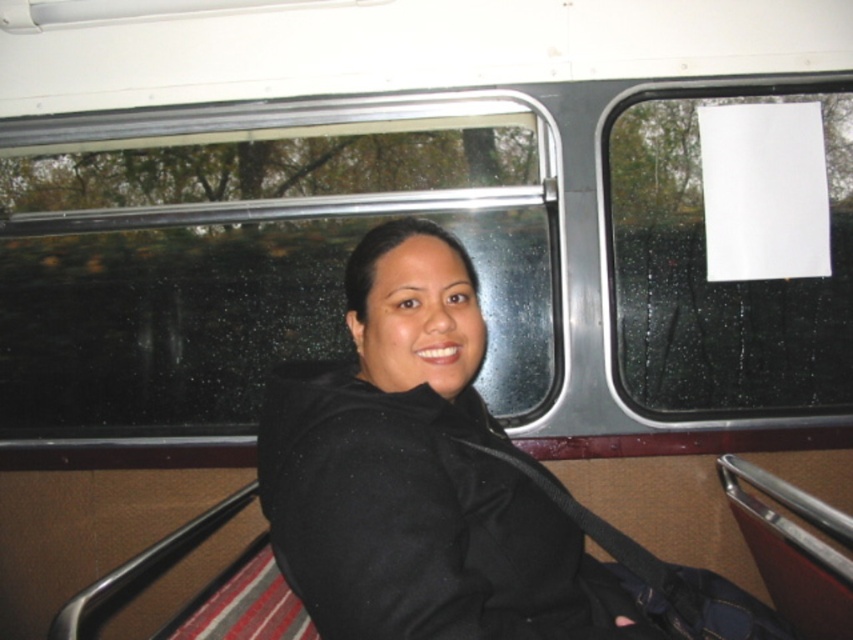
Question: In this image, where is black matte jacket at center located relative to white paper at upper right?

Choices:
 (A) right
 (B) left

Answer: (B)

Question: Which of the following is the farthest from the observer?

Choices:
 (A) (619, 358)
 (B) (338, 540)

Answer: (A)

Question: In this image, where is transparent glass window at upper center located relative to black matte jacket at center?

Choices:
 (A) above
 (B) below

Answer: (A)

Question: Which point is closer to the camera?

Choices:
 (A) transparent glass window at upper center
 (B) black matte jacket at center
 (C) white paper at upper right

Answer: (B)

Question: Considering the relative positions of transparent glass window at upper center and black matte jacket at center in the image provided, where is transparent glass window at upper center located with respect to black matte jacket at center?

Choices:
 (A) below
 (B) above

Answer: (B)

Question: Which point is closer to the camera?

Choices:
 (A) transparent glass window at upper center
 (B) black matte jacket at center

Answer: (B)